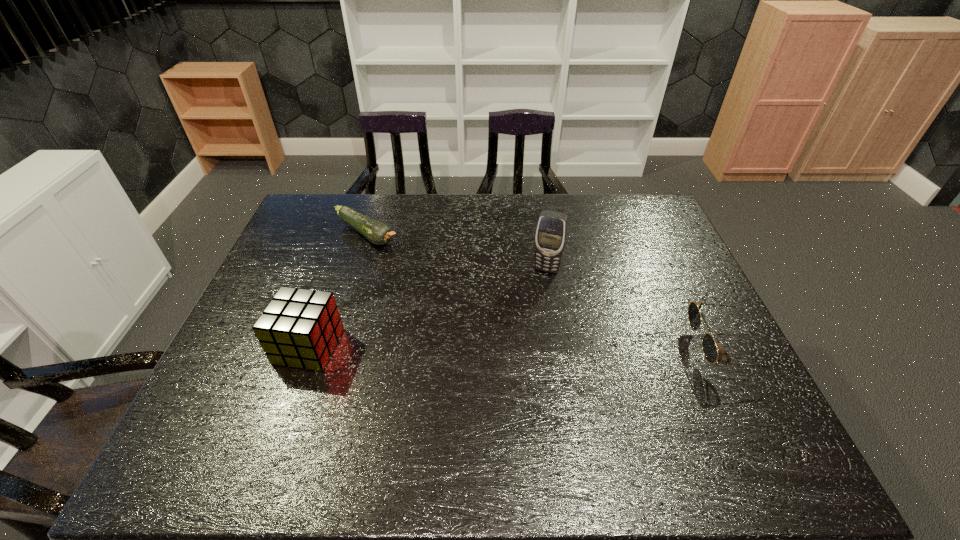
Identify the location of the second tallest object. This screenshot has width=960, height=540. (299, 328).

Identify the location of sunglasses. This screenshot has width=960, height=540. (709, 347).

Image resolution: width=960 pixels, height=540 pixels. Identify the location of the rightmost object. (709, 347).

Locate an element on the screen. The height and width of the screenshot is (540, 960). the shortest object is located at coordinates (378, 233).

The height and width of the screenshot is (540, 960). I want to click on the farthest object, so click(x=378, y=233).

Image resolution: width=960 pixels, height=540 pixels. I want to click on the tallest object, so click(x=551, y=232).

This screenshot has width=960, height=540. I want to click on cellular telephone, so click(551, 232).

The height and width of the screenshot is (540, 960). Find the location of `vacant space located 0.100m on the front of the cube`. vacant space located 0.100m on the front of the cube is located at coordinates (286, 409).

I want to click on free space located on the front lenses of the second shortest object, so click(x=665, y=347).

I want to click on vacant space located 0.210m on the front lenses of the second shortest object, so click(x=611, y=347).